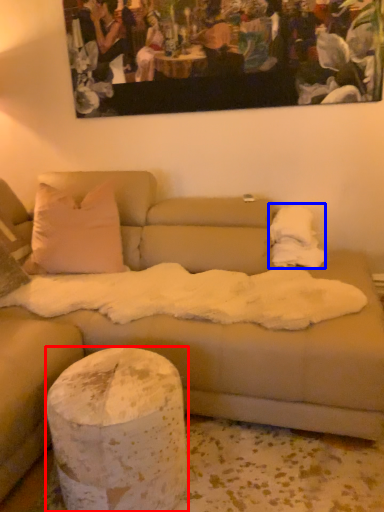
Question: Which of the following is the closest to the observer, pillar (highlighted by a red box) or blanket (highlighted by a blue box)?

Choices:
 (A) pillar
 (B) blanket

Answer: (A)